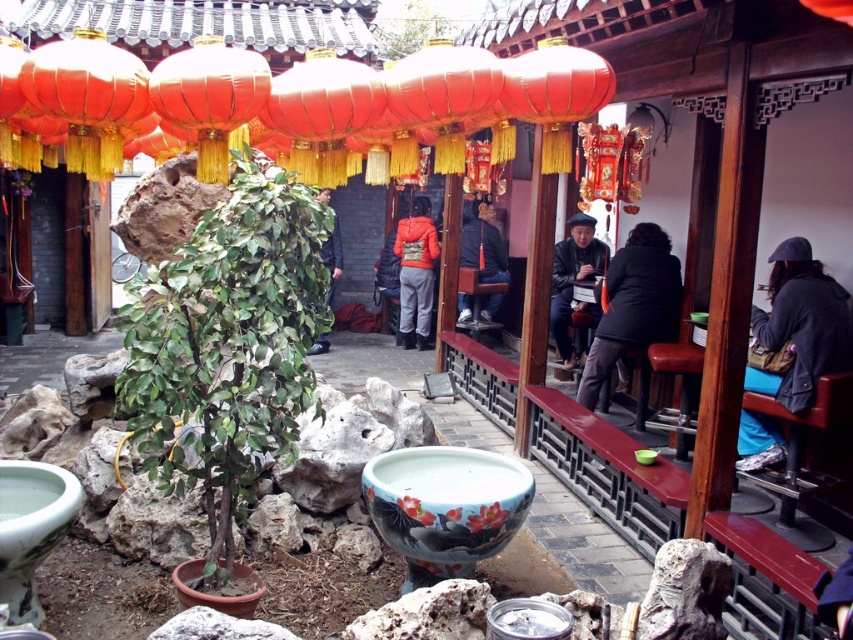
You are a visitor in this courtyard and see the green leafy plant at center and the dark gray leather jacket at center. Which object is positioned more to the left?

The green leafy plant at center is positioned more to the left than the dark gray leather jacket at center.

You are a guest in this courtyard and want to place a small statue between the green leafy plant at center and the shiny red paper lantern at upper center. Can you tell me which side of the lantern the statue should be placed to maintain the current arrangement?

The green leafy plant at center is positioned on the left side of shiny red paper lantern at upper center, so to maintain the current arrangement, the statue should be placed to the left side of the shiny red paper lantern at upper center.